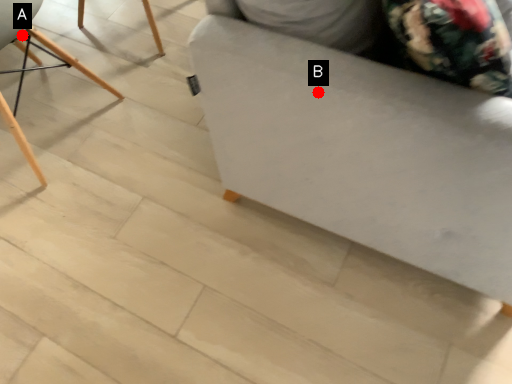
Question: Two points are circled on the image, labeled by A and B beside each circle. Which point is closer to the camera taking this photo?

Choices:
 (A) A is closer
 (B) B is closer

Answer: (B)